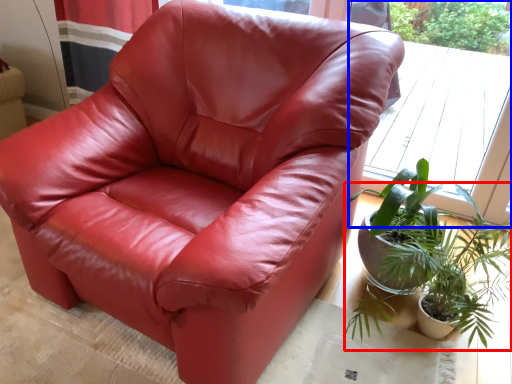
Question: Among these objects, which one is farthest to the camera, houseplant (highlighted by a red box) or window (highlighted by a blue box)?

Choices:
 (A) houseplant
 (B) window

Answer: (B)